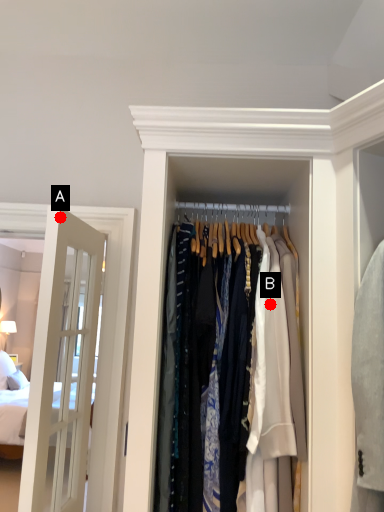
Question: Two points are circled on the image, labeled by A and B beside each circle. Which point is closer to the camera taking this photo?

Choices:
 (A) A is closer
 (B) B is closer

Answer: (B)